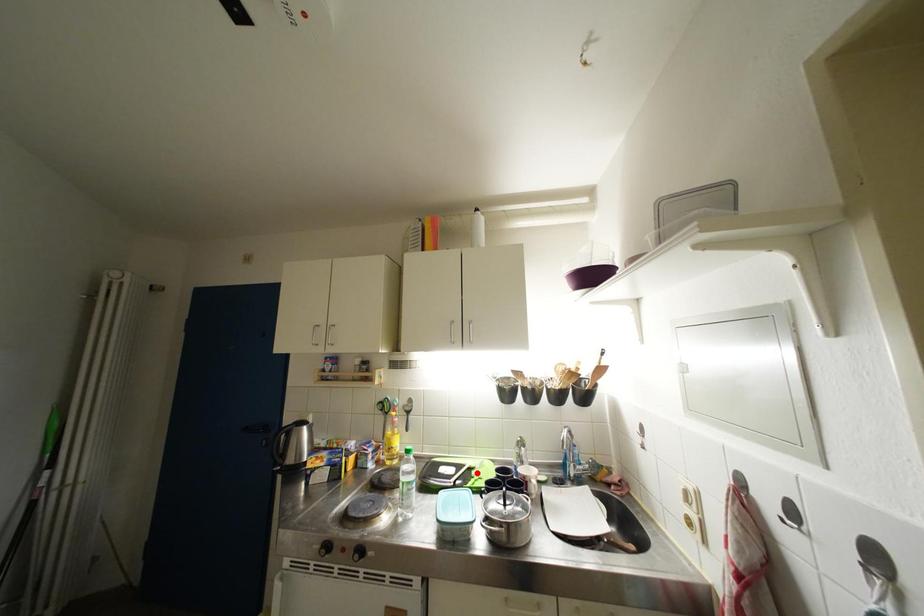
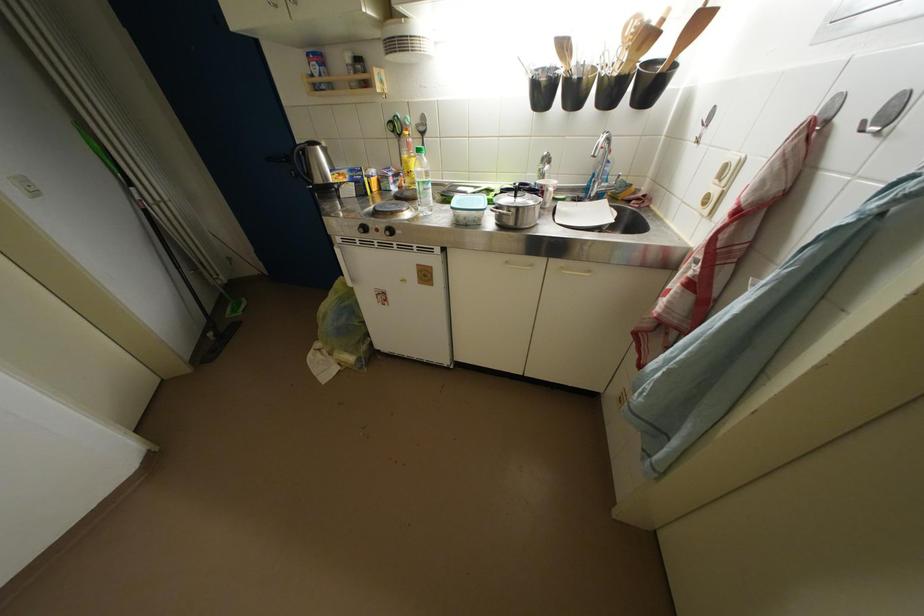
Locate, in the second image, the point that corresponds to the highlighted location in the first image.

(495, 193)